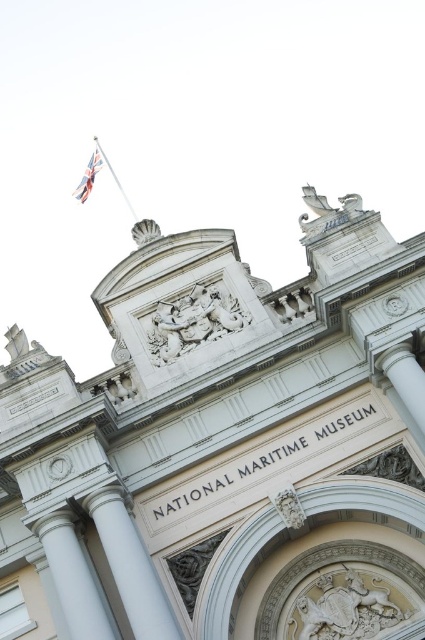
Question: Is the position of polished silver flag at upper left less distant than that of polished silver flag pole at upper left?

Choices:
 (A) yes
 (B) no

Answer: (B)

Question: Which object is closer to the camera taking this photo?

Choices:
 (A) polished silver flag pole at upper left
 (B) polished silver flag at upper left

Answer: (A)

Question: Which point appears closest to the camera in this image?

Choices:
 (A) (113, 172)
 (B) (82, 177)

Answer: (A)

Question: Which of the following is the closest to the observer?

Choices:
 (A) polished silver flag pole at upper left
 (B) polished silver flag at upper left

Answer: (A)

Question: In this image, where is polished silver flag at upper left located relative to polished silver flag pole at upper left?

Choices:
 (A) right
 (B) left

Answer: (B)

Question: Can you confirm if polished silver flag at upper left is positioned below polished silver flag pole at upper left?

Choices:
 (A) yes
 (B) no

Answer: (B)